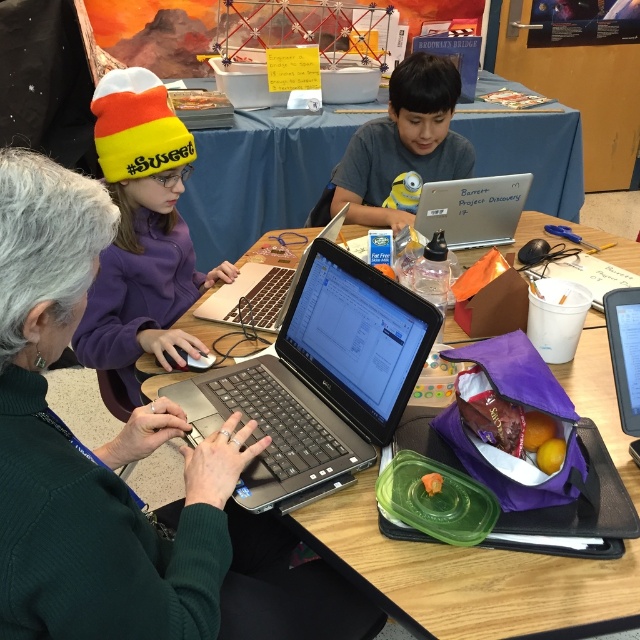
You are a student who needs to place a 1.2 meter long project board between the wooden table at center and the orange knit beanie at upper left. Will there be enough space?

The distance between the wooden table at center and the orange knit beanie at upper left is 1.22 meters, so the 1.2 meter project board will fit with 2 centimeters to spare.

You are a participant in this workshop and need to pass a document from the black matte laptop at center to the black glossy tablet at right. Can you do this without moving from your current position?

The black matte laptop at center and black glossy tablet at right are 23.99 inches apart from each other. Since the distance between them is over 24 inches, you cannot reach them both at the same time without moving.

You are organizing a workshop and need to place a large poster on the table. The poster is as big as the wooden table at center. Will the black plastic laptop at center fit on the table along with the poster?

The black plastic laptop at center is smaller than the wooden table at center, so it should fit alongside the poster since the poster is the same size as the table.